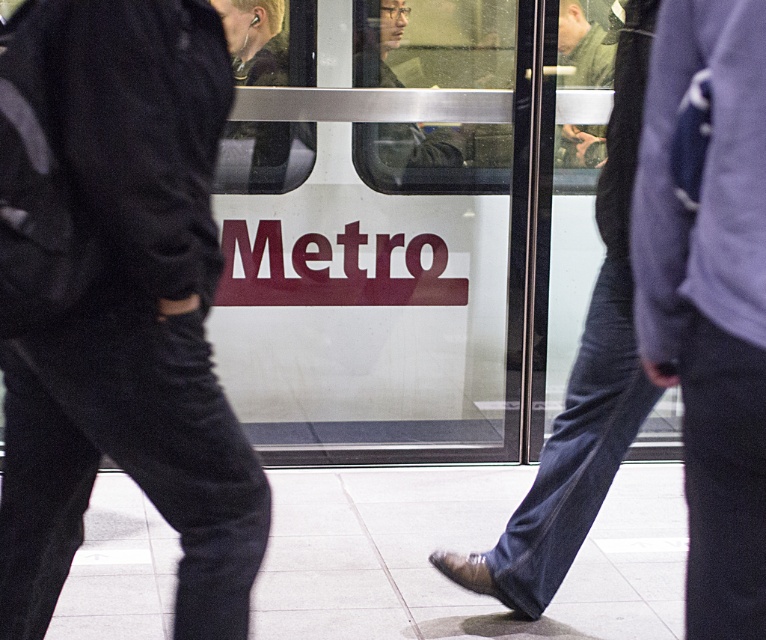
You are standing in the subway station and want to take a photo of both the point at coordinates (198, 234) and the point at coordinates (416, 140). Which point will appear larger in your photo?

Point at coordinates (198, 234) will appear larger in the photo because it is closer to the camera than point at coordinates (416, 140).

You are standing in the subway station and see the three people walking past. Which object corresponds to the coordinates point (133,328)?

The point (133,328) corresponds to the black matte pants at left.

What are the coordinates of the purple sweater at right?

The purple sweater at right is located at point (709,298).